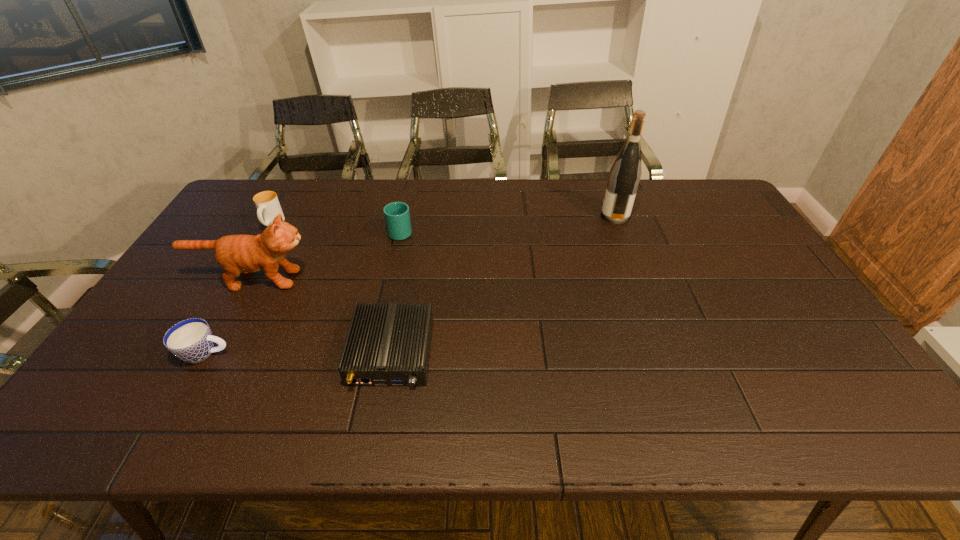
The width and height of the screenshot is (960, 540). Find the location of `blank area located on the handle side of the rightmost cup`. blank area located on the handle side of the rightmost cup is located at coordinates pyautogui.click(x=406, y=205).

Locate an element on the screen. This screenshot has width=960, height=540. vacant position located 0.100m on the handle side of the rightmost cup is located at coordinates (406, 205).

Find the location of `vacant space positioned on the side of the nearest cup with the handle`. vacant space positioned on the side of the nearest cup with the handle is located at coordinates (260, 353).

In order to click on vacant space situated 0.100m on the back panel of the router in this screenshot , I will do `click(376, 434)`.

This screenshot has width=960, height=540. I want to click on wine bottle that is at the far edge, so click(625, 173).

At what (x,y) coordinates should I click in order to perform the action: click on cup that is positioned at the far edge. Please return your answer as a coordinate pair (x, y). Looking at the image, I should click on (268, 207).

Identify the location of cat present at the left edge. (236, 254).

Identify the location of object positioned at the far left corner. tap(268, 207).

Locate an element on the screen. The width and height of the screenshot is (960, 540). blank space at the far edge of the desktop is located at coordinates (589, 205).

The height and width of the screenshot is (540, 960). In the image, there is a desktop. In order to click on free space at the near edge in this screenshot , I will do `click(705, 429)`.